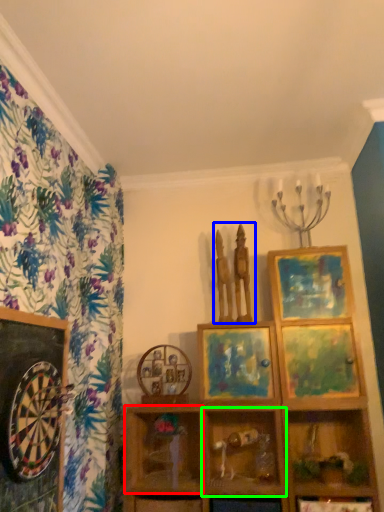
Question: Based on their relative distances, which object is farther from cabinet (highlighted by a red box)? Choose from sculpture (highlighted by a blue box) and shelf (highlighted by a green box).

Choices:
 (A) sculpture
 (B) shelf

Answer: (A)